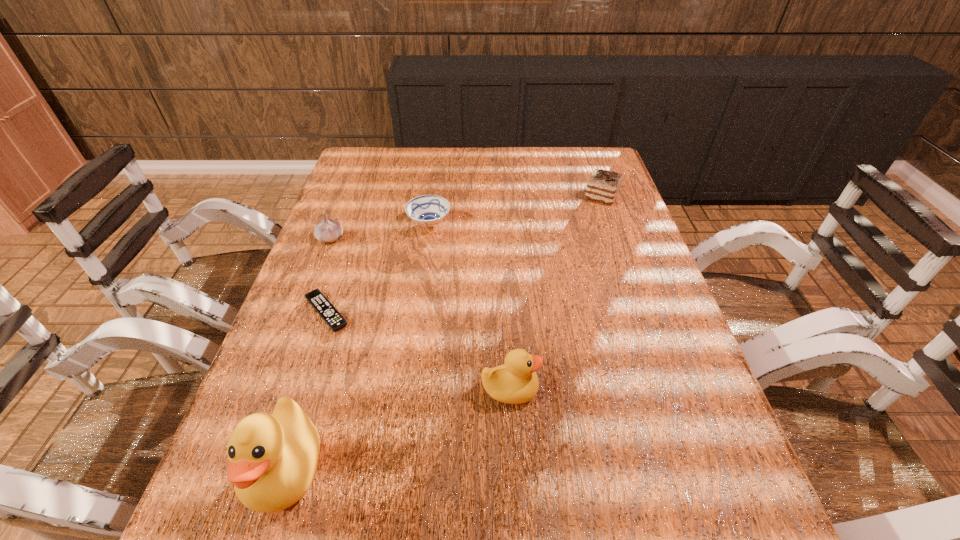
You are a GUI agent. You are given a task and a screenshot of the screen. Output one action in this format:
    pyautogui.click(x=<x>, y=<y>)
    Task: Click on the object that is at the right edge
    
    Given the screenshot: What is the action you would take?
    pyautogui.click(x=603, y=186)

The height and width of the screenshot is (540, 960). I want to click on object at the near left corner, so click(x=272, y=459).

This screenshot has height=540, width=960. In order to click on free region at the far edge of the desktop in this screenshot , I will do `click(427, 154)`.

I want to click on free point at the near edge, so click(x=542, y=441).

Identify the location of free space at the left edge of the desktop. (381, 201).

Find the location of a particular element. Image resolution: width=960 pixels, height=540 pixels. vacant space at the right edge of the desktop is located at coordinates (684, 380).

The width and height of the screenshot is (960, 540). Identify the location of vacant area between the garlic and the farthest object. [x=467, y=217].

Identify the location of empty space that is in between the taller duck and the rightmost object. This screenshot has width=960, height=540. (444, 332).

Where is `free space between the fourth farthest object and the rightmost object`? This screenshot has height=540, width=960. free space between the fourth farthest object and the rightmost object is located at coordinates (464, 254).

Where is `free space between the remote control and the garlic`? This screenshot has height=540, width=960. free space between the remote control and the garlic is located at coordinates (328, 275).